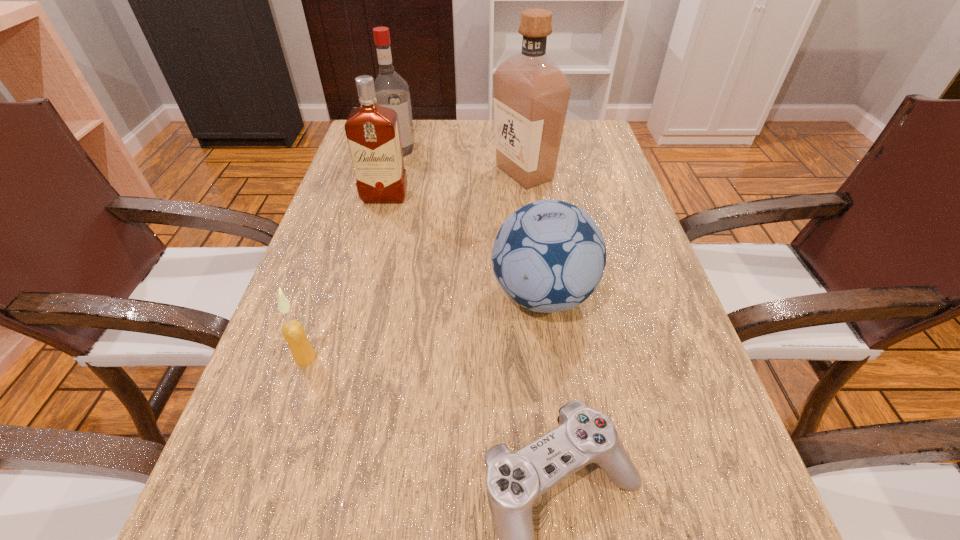
At what (x,y) coordinates should I click in order to perform the action: click on vacant region located 0.090m on the side with brand of the third shortest object. Please return your answer as a coordinate pair (x, y). The image size is (960, 540). Looking at the image, I should click on (444, 295).

This screenshot has width=960, height=540. What are the coordinates of `free location located 0.370m on the side with brand of the third shortest object` in the screenshot? It's located at (300, 295).

At what (x,y) coordinates should I click in order to perform the action: click on free space located on the front of the candle. Please return your answer as a coordinate pair (x, y). This screenshot has width=960, height=540. Looking at the image, I should click on (269, 469).

Image resolution: width=960 pixels, height=540 pixels. What are the coordinates of `candle situated at the left edge` in the screenshot? It's located at (293, 331).

Locate an element on the screen. liquor at the right edge is located at coordinates (531, 93).

At what (x,y) coordinates should I click in order to perform the action: click on soccer ball positioned at the right edge. Please return your answer as a coordinate pair (x, y). This screenshot has height=540, width=960. Looking at the image, I should click on (549, 256).

You are a GUI agent. You are given a task and a screenshot of the screen. Output one action in this format:
    pyautogui.click(x=<x>, y=<y>)
    Task: Click on the object positioned at the far left corner
    The height and width of the screenshot is (540, 960).
    Given the screenshot: What is the action you would take?
    pyautogui.click(x=392, y=91)

Identify the location of object located in the far right corner section of the desktop. (531, 93).

Identify the location of free space at the left edge of the desktop. This screenshot has height=540, width=960. pos(335,218).

Find the location of `vacant space at the right edge of the desktop`. vacant space at the right edge of the desktop is located at coordinates (665, 316).